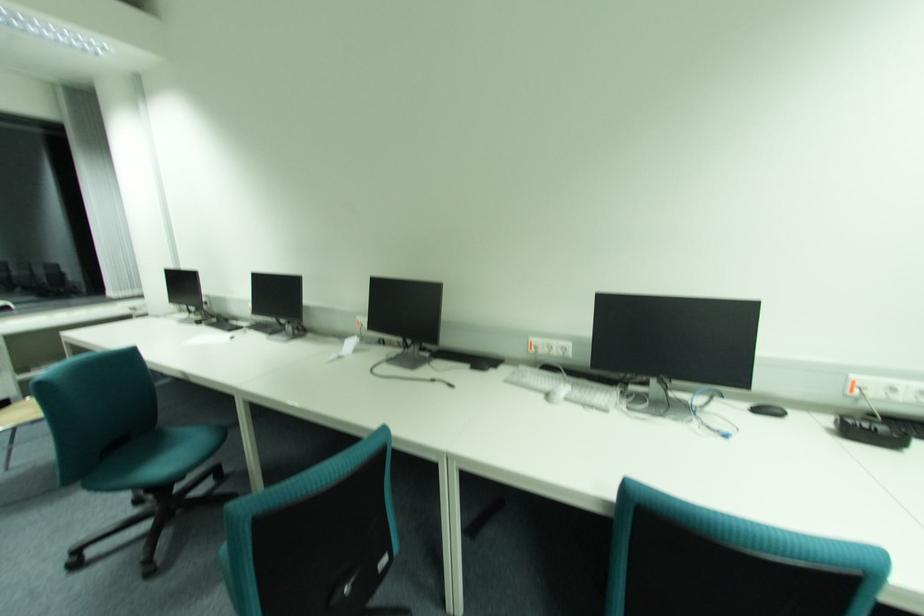
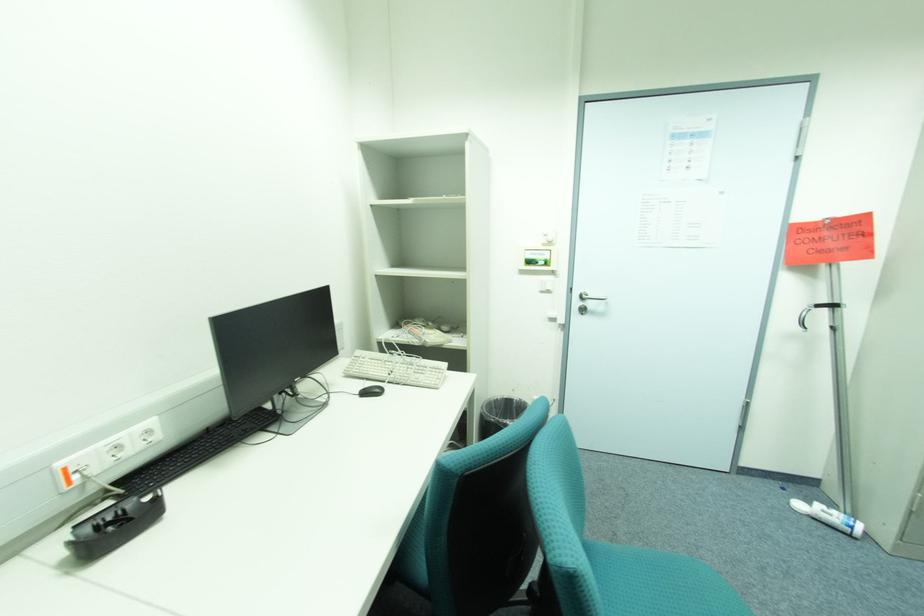
Question: The camera is either moving clockwise (left) or counter-clockwise (right) around the object. The first image is from the beginning of the video and the second image is from the end. Is the camera moving left or right when shooting the video?

Choices:
 (A) Left
 (B) Right

Answer: (A)